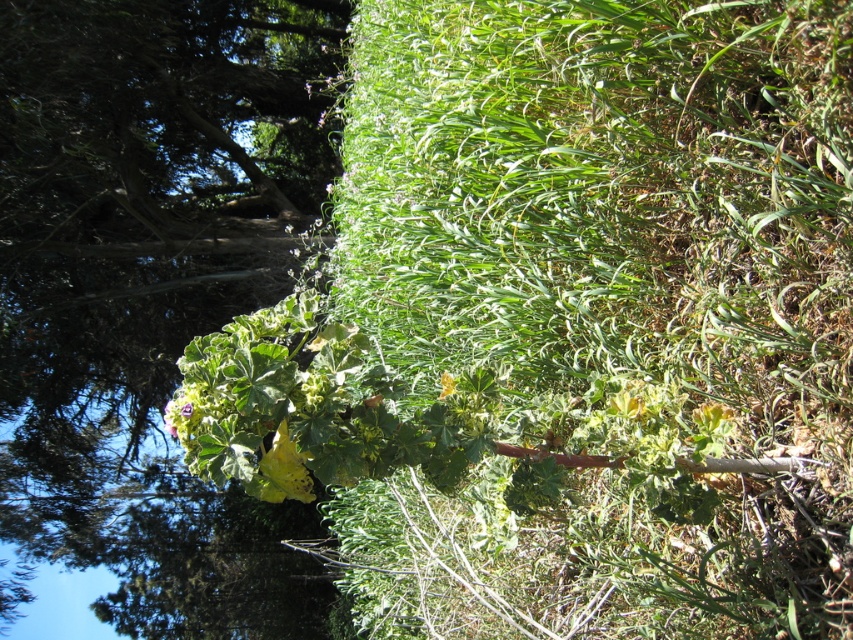
Question: Is yellow matte flower at center smaller than green matte leaf at center?

Choices:
 (A) no
 (B) yes

Answer: (A)

Question: Considering the real-world distances, which object is closest to the yellow matte flower at center?

Choices:
 (A) yellow matte leaf at center
 (B) green matte leaf at center

Answer: (A)

Question: Which is nearer to the yellow matte flower at center?

Choices:
 (A) green matte leaf at center
 (B) yellow matte leaf at center

Answer: (B)

Question: Can you confirm if yellow matte leaf at center is positioned below green matte leaf at center?

Choices:
 (A) yes
 (B) no

Answer: (A)

Question: Is yellow matte flower at center above green matte leaf at center?

Choices:
 (A) no
 (B) yes

Answer: (B)

Question: Which object is farther from the camera taking this photo?

Choices:
 (A) yellow matte flower at center
 (B) yellow matte leaf at center
 (C) green matte leaf at center

Answer: (A)